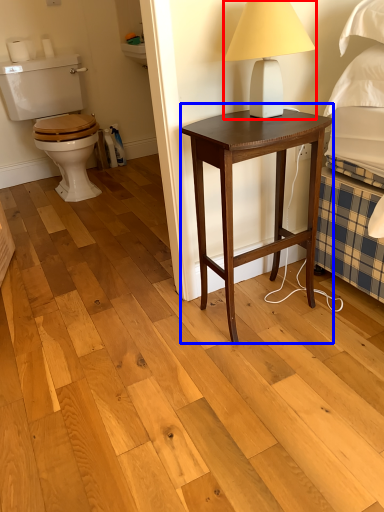
Question: Which of the following is the closest to the observer, table lamp (highlighted by a red box) or nightstand (highlighted by a blue box)?

Choices:
 (A) table lamp
 (B) nightstand

Answer: (A)